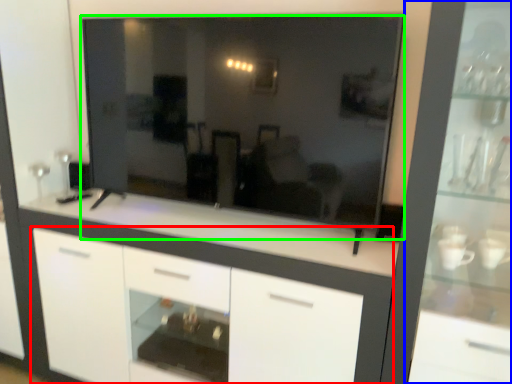
Question: Considering the real-world distances, which object is farthest from cabinetry (highlighted by a red box)? dresser (highlighted by a blue box) or mirror (highlighted by a green box)?

Choices:
 (A) dresser
 (B) mirror

Answer: (A)